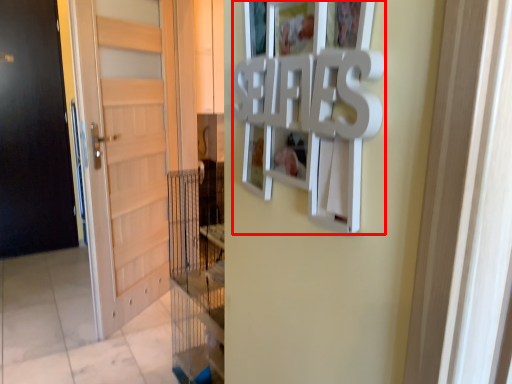
Question: From the image's perspective, considering the relative positions of picture frame (annotated by the red box) and door in the image provided, where is picture frame (annotated by the red box) located with respect to the staircase?

Choices:
 (A) above
 (B) below

Answer: (A)